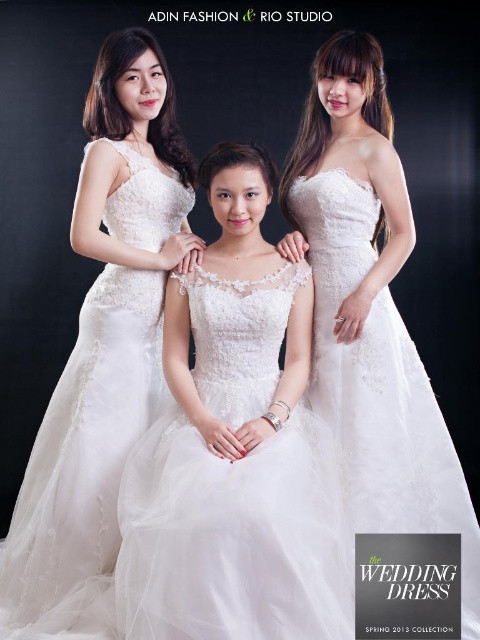
You are a photographer arranging three women for a wedding photo shoot. The scene requires the woman in the white lace dress at center to be positioned so that her dress does not overlap with the white lace dress at upper right. Given their dress widths, which woman should you move slightly to the side to avoid overlapping?

The white lace dress at center has a larger width than the white lace dress at upper right. To prevent overlapping, move the white lace dress at upper right slightly to the side since it is narrower and easier to adjust without disrupting the central focus of the photo.

You are a photographer arranging a group photo of two women. You have a lace fabric wedding dress at center and a white lace dress at upper right. Which dress is covering part of the other?

The lace fabric wedding dress at center is positioned over the white lace dress at upper right, so it is covering part of it.